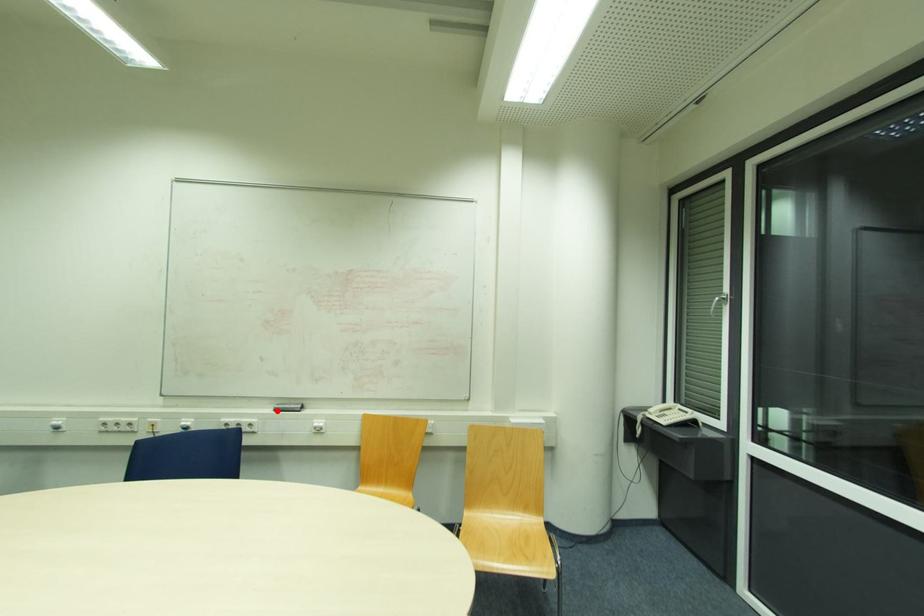
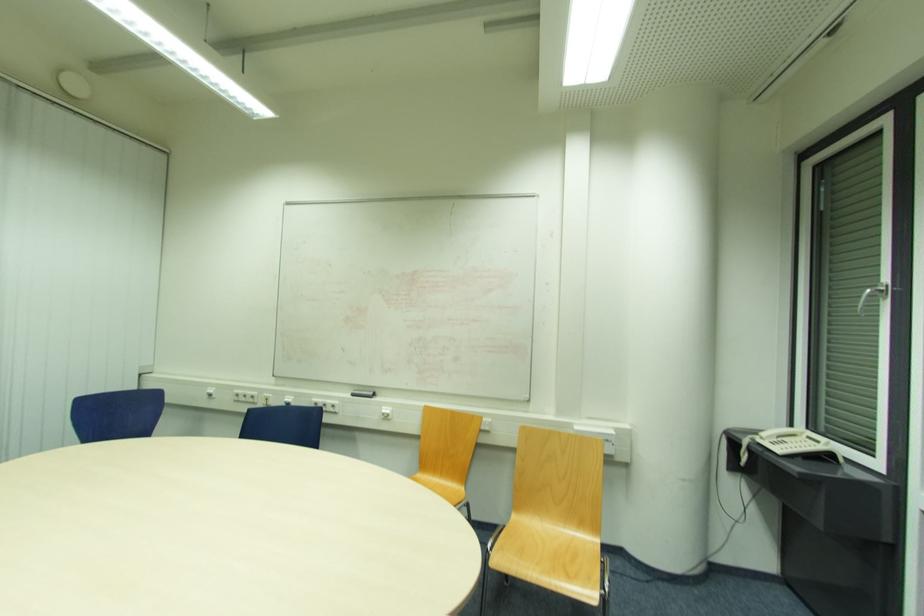
Find the pixel in the second image that matches the highlighted location in the first image.

(355, 395)